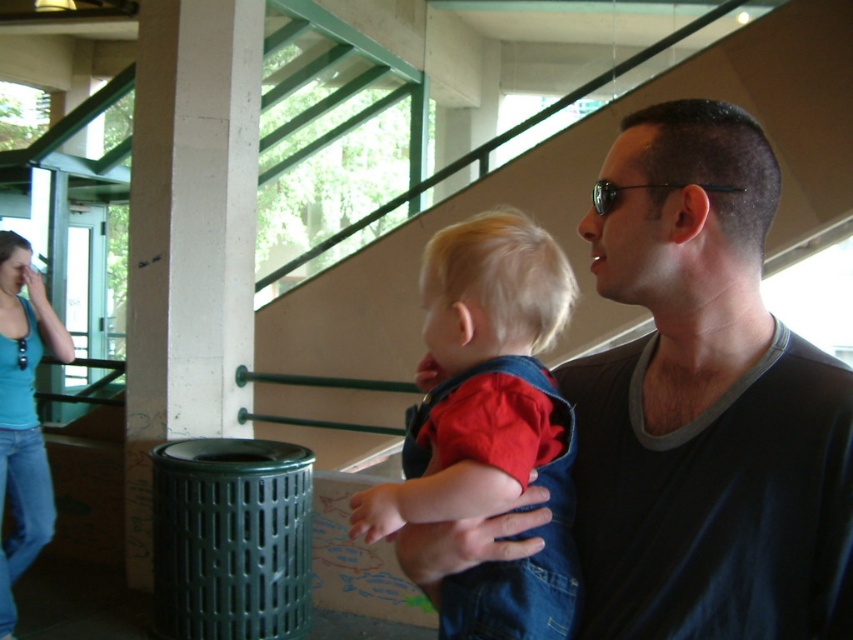
You are a fashion designer observing the denim clothing items in the scene. Which item is wider between the denim overalls at center and the blue denim jeans at left?

The denim overalls at center is wider than the blue denim jeans at left as stated in the description.

Based on the photo, you are standing in a public space like a stadium and see a man holding a child. The man is looking slightly upwards and to his left. If you want to take a photo of the man and the child from your current position, will the point at coordinates point (602,404) be within the frame of your camera? Assume your camera has a standard field of view and you are 4.20 feet away from the point.

The point at coordinates point (602,404) is 4.20 feet away from you, so depending on your camera angle and field of view, it might be within the frame. However, without knowing the exact camera specifications, it is difficult to determine with certainty.